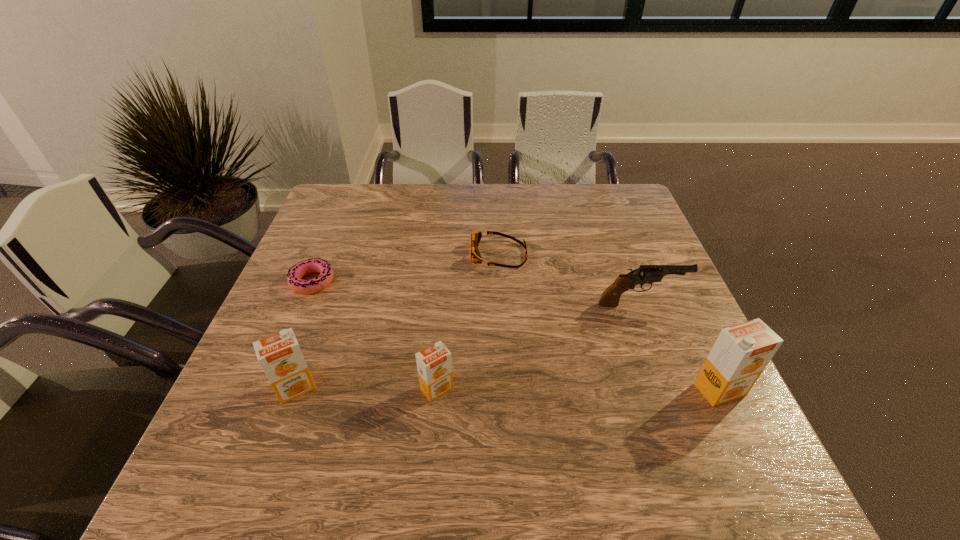
Locate an element on the screen. The image size is (960, 540). vacant space located on the right of the shortest orange juice is located at coordinates (624, 388).

At what (x,y) coordinates should I click in order to perform the action: click on vacant space located 0.090m on the left of the tallest object. Please return your answer as a coordinate pair (x, y). Looking at the image, I should click on (652, 389).

The image size is (960, 540). I want to click on vacant space located with the lenses facing forward on the goggles, so click(384, 254).

Find the location of a particular element. This screenshot has width=960, height=540. vacant area situated 0.210m with the lenses facing forward on the goggles is located at coordinates (395, 254).

The image size is (960, 540). I want to click on vacant region located with the lenses facing forward on the goggles, so click(373, 254).

The width and height of the screenshot is (960, 540). I want to click on vacant space positioned 0.180m on the right of the shortest object, so click(x=403, y=282).

Where is `orange juice located at the left edge`? This screenshot has width=960, height=540. orange juice located at the left edge is located at coordinates (279, 355).

Image resolution: width=960 pixels, height=540 pixels. What are the coordinates of `doughnut located in the left edge section of the desktop` in the screenshot? It's located at (313, 265).

Locate an element on the screen. orange juice situated at the right edge is located at coordinates (740, 354).

The height and width of the screenshot is (540, 960). In order to click on gun that is at the right edge in this screenshot , I will do `click(646, 274)`.